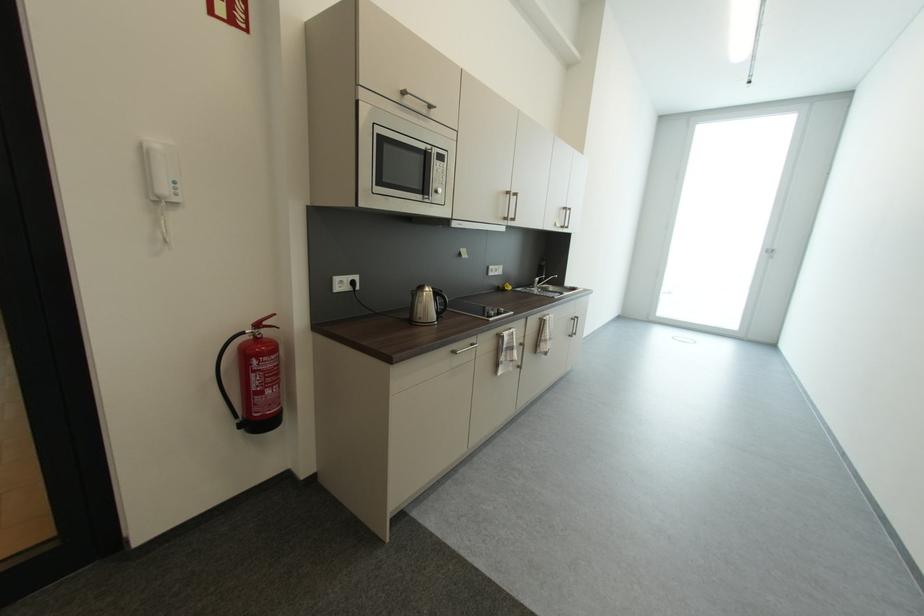
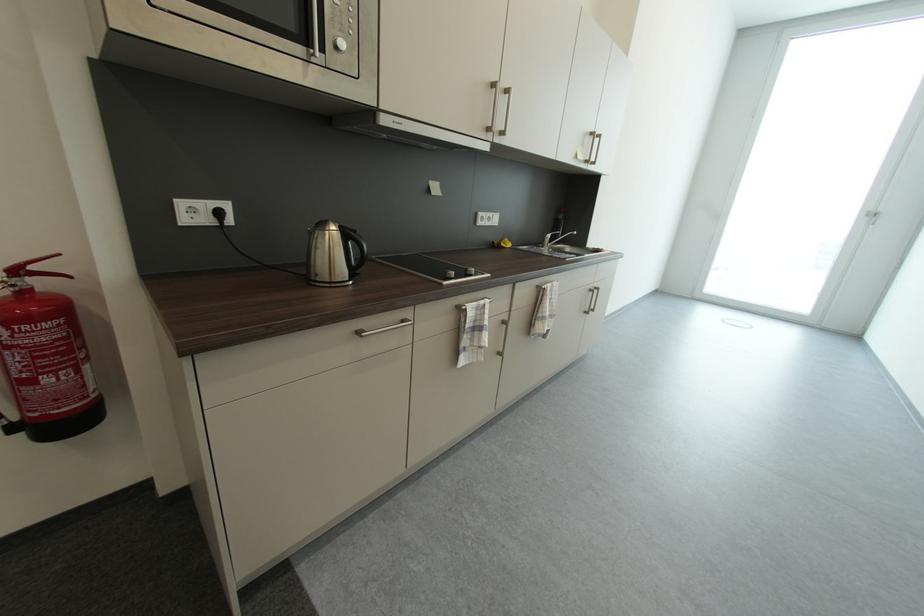
The point at (505, 288) is marked in the first image. Where is the corresponding point in the second image?

(501, 244)